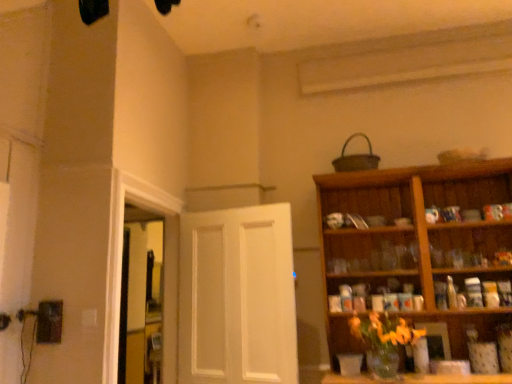
Question: Is white matte door at center far from transparent glass window at left?

Choices:
 (A) yes
 (B) no

Answer: (B)

Question: Does white matte door at center have a lesser height compared to transparent glass window at left?

Choices:
 (A) yes
 (B) no

Answer: (A)

Question: Is white matte door at center closer to the viewer compared to transparent glass window at left?

Choices:
 (A) no
 (B) yes

Answer: (B)

Question: Can you confirm if white matte door at center is thinner than transparent glass window at left?

Choices:
 (A) no
 (B) yes

Answer: (B)

Question: Could you tell me if white matte door at center is facing transparent glass window at left?

Choices:
 (A) no
 (B) yes

Answer: (A)

Question: In terms of size, does wooden cabinet at upper right appear bigger or smaller than transparent glass window at left?

Choices:
 (A) big
 (B) small

Answer: (A)

Question: From the image's perspective, relative to transparent glass window at left, is wooden cabinet at upper right above or below?

Choices:
 (A) below
 (B) above

Answer: (B)

Question: From a real-world perspective, is wooden cabinet at upper right physically located above or below transparent glass window at left?

Choices:
 (A) below
 (B) above

Answer: (B)

Question: In terms of width, does wooden cabinet at upper right look wider or thinner when compared to transparent glass window at left?

Choices:
 (A) wide
 (B) thin

Answer: (A)

Question: Based on their positions, is white matte door at center located to the left or right of wooden cabinet at upper right?

Choices:
 (A) left
 (B) right

Answer: (A)

Question: Is white matte door at center in front of or behind wooden cabinet at upper right in the image?

Choices:
 (A) front
 (B) behind

Answer: (B)

Question: Is white matte door at center inside or outside of wooden cabinet at upper right?

Choices:
 (A) inside
 (B) outside

Answer: (B)

Question: In terms of height, does white matte door at center look taller or shorter compared to wooden cabinet at upper right?

Choices:
 (A) short
 (B) tall

Answer: (A)

Question: From the image's perspective, is white matte door at center located above or below transparent glass window at left?

Choices:
 (A) above
 (B) below

Answer: (A)

Question: Is white matte door at center situated inside transparent glass window at left or outside?

Choices:
 (A) inside
 (B) outside

Answer: (B)